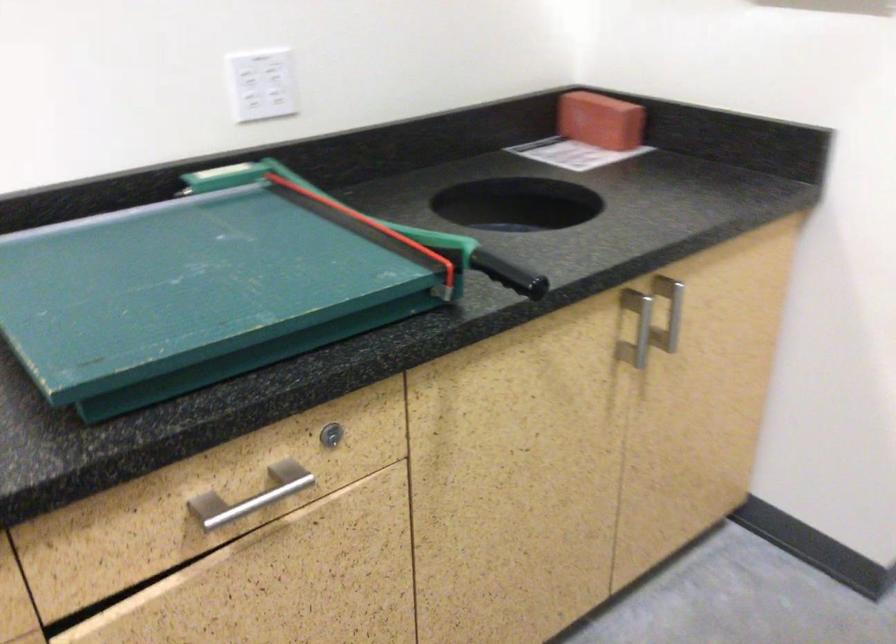
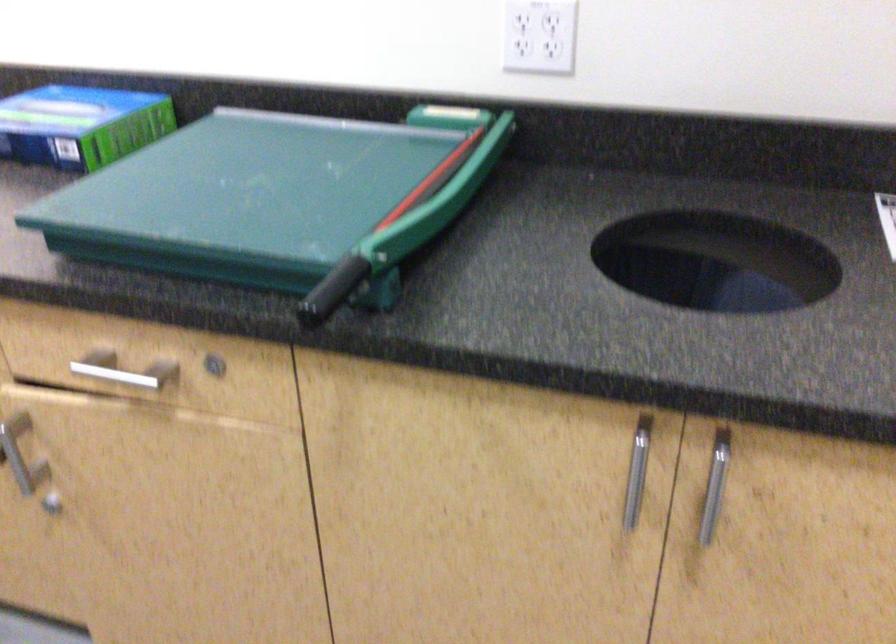
In the second image, find the point that corresponds to (650,327) in the first image.

(636, 471)